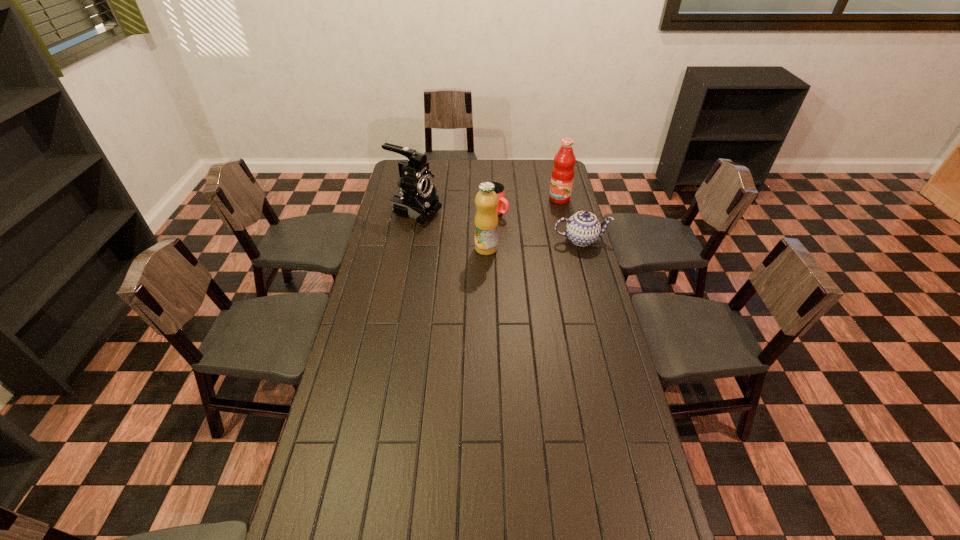
Find the location of a particular element. the nearer fruit juice is located at coordinates (486, 219).

This screenshot has height=540, width=960. What are the coordinates of `chinaware` in the screenshot? It's located at (583, 228).

This screenshot has width=960, height=540. What are the coordinates of `camcorder` in the screenshot? It's located at (417, 198).

This screenshot has height=540, width=960. What are the coordinates of `the farther fruit juice` in the screenshot? It's located at (562, 177).

This screenshot has height=540, width=960. I want to click on cup, so click(x=499, y=188).

At what (x,y) coordinates should I click in order to perform the action: click on vacant point located 0.260m on the front label of the left fruit juice. Please return your answer as a coordinate pair (x, y). This screenshot has width=960, height=540. Looking at the image, I should click on (487, 301).

Locate an element on the screen. free region located at the spout of the chinaware is located at coordinates point(596,296).

This screenshot has width=960, height=540. Identify the location of free point located 0.310m on the lens mount of the camcorder. (499, 238).

Identify the location of vacant space located on the lens mount of the camcorder. The width and height of the screenshot is (960, 540). (466, 228).

This screenshot has width=960, height=540. Identify the location of free space located 0.390m on the lens mount of the camcorder. (516, 244).